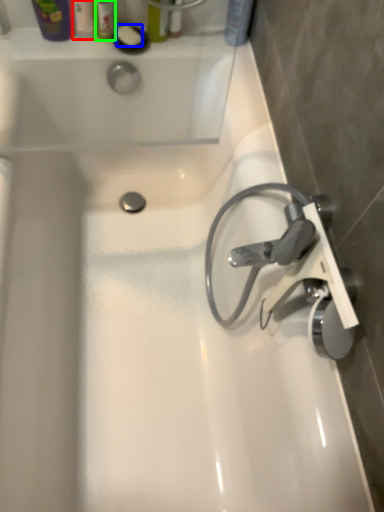
Question: Based on their relative distances, which object is nearer to toiletry (highlighted by a red box)? Choose from soap (highlighted by a blue box) and toiletry (highlighted by a green box).

Choices:
 (A) soap
 (B) toiletry

Answer: (B)